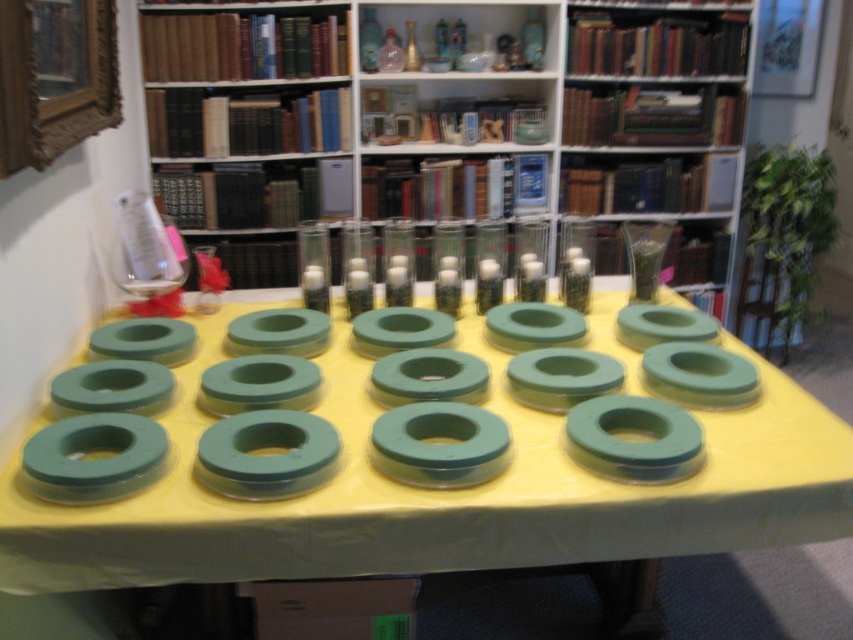
You are standing in front of the table with foam rings and want to reach two points marked on the table. The first point is at coordinates point (596, 45) and the second point is at point (152, 499). Which point is closer to you?

Point (596, 45) is closer to you because it is further to the viewer than point (152, 499).

You are organizing a childrens party and need to set up an activity area. You have a space that can only accommodate items that are to the left of the wooden bookshelf at upper center. Are the green rubber rings at center suitable for placement in this area?

The wooden bookshelf at upper center is positioned on the right side of green rubber rings at center. Since the green rubber rings at center are to the left of the wooden bookshelf at upper center, they can be placed in the available space.

You are a delivery person who needs to place a package that is 5 feet long on the floor between the wooden bookshelf at upper center and the green rubber rings at center. Is there enough space for the package to fit without overlapping either object?

The wooden bookshelf at upper center is 4.75 feet away from the green rubber rings at center. Since the package is 5 feet long, it would require more space than available between the two objects. Therefore, the package cannot be placed between them without overlapping.